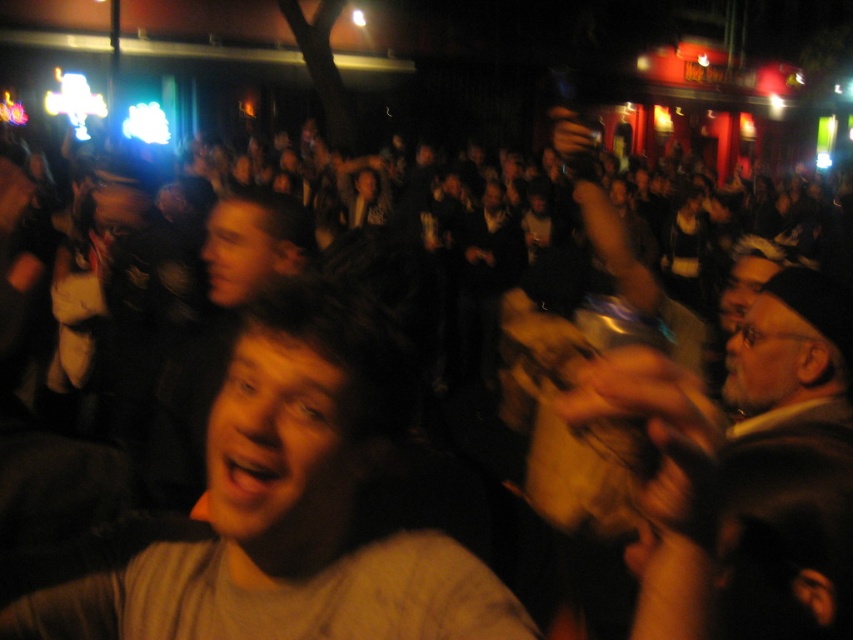
Who is higher up, gray cotton shirt at center or gray wool sweater at center?

Positioned higher is gray wool sweater at center.

Who is more distant from viewer, (271, 628) or (688, 460)?

The point (271, 628) is behind.

What do you see at coordinates (291, 506) in the screenshot?
I see `gray cotton shirt at center` at bounding box center [291, 506].

In order to click on gray cotton shirt at center in this screenshot , I will do `click(291, 506)`.